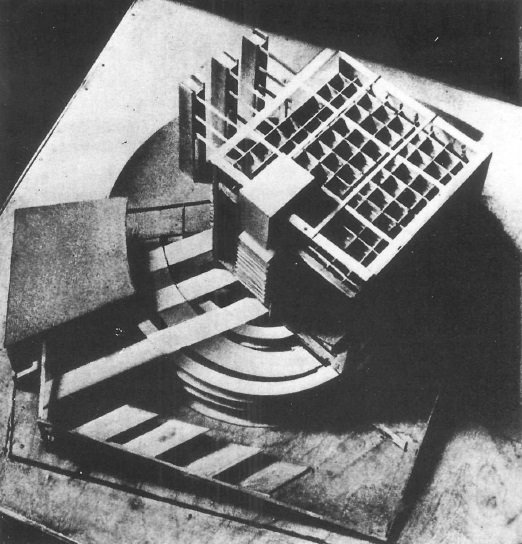
I want to click on wires, so click(x=209, y=103), click(x=206, y=125), click(x=204, y=143).